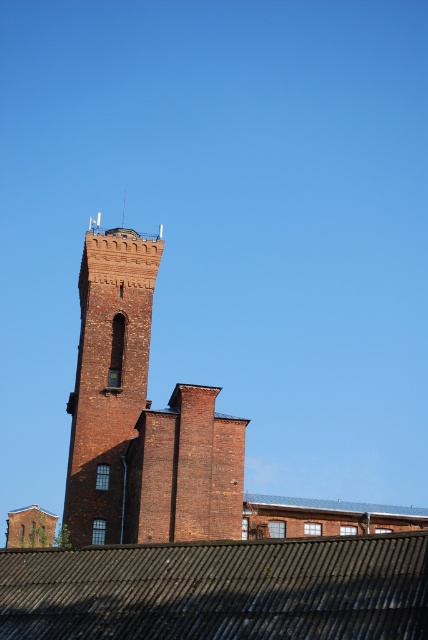
Which is more to the left, brick tower at upper left or metallic corrugated roof at center?

brick tower at upper left is more to the left.

Between brick tower at upper left and metallic corrugated roof at center, which one is positioned higher?

brick tower at upper left is higher up.

Describe the element at coordinates (107, 378) in the screenshot. I see `brick tower at upper left` at that location.

What are the coordinates of `brick tower at upper left` in the screenshot? It's located at (107, 378).

Can you confirm if rusty corrugated metal roof at lower center is smaller than metallic corrugated roof at center?

Indeed, rusty corrugated metal roof at lower center has a smaller size compared to metallic corrugated roof at center.

Is rusty corrugated metal roof at lower center behind metallic corrugated roof at center?

No, rusty corrugated metal roof at lower center is closer to the viewer.

Identify the location of rusty corrugated metal roof at lower center. (219, 589).

Which is in front, point (374, 538) or point (142, 272)?

Point (374, 538) is more forward.

You are a GUI agent. You are given a task and a screenshot of the screen. Output one action in this format:
    pyautogui.click(x=<x>, y=<y>)
    Task: Click on the rusty corrugated metal roof at lower center
    
    Given the screenshot: What is the action you would take?
    pyautogui.click(x=219, y=589)